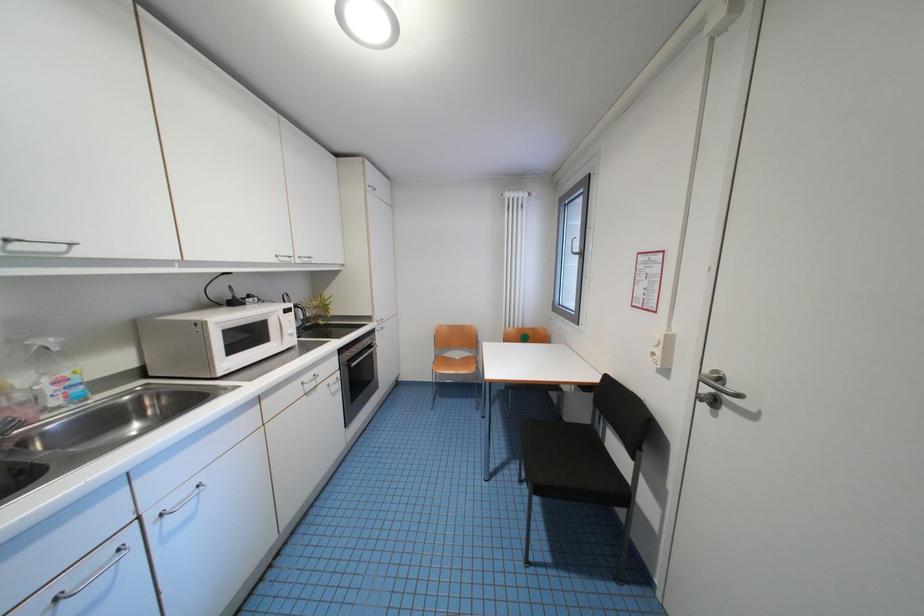
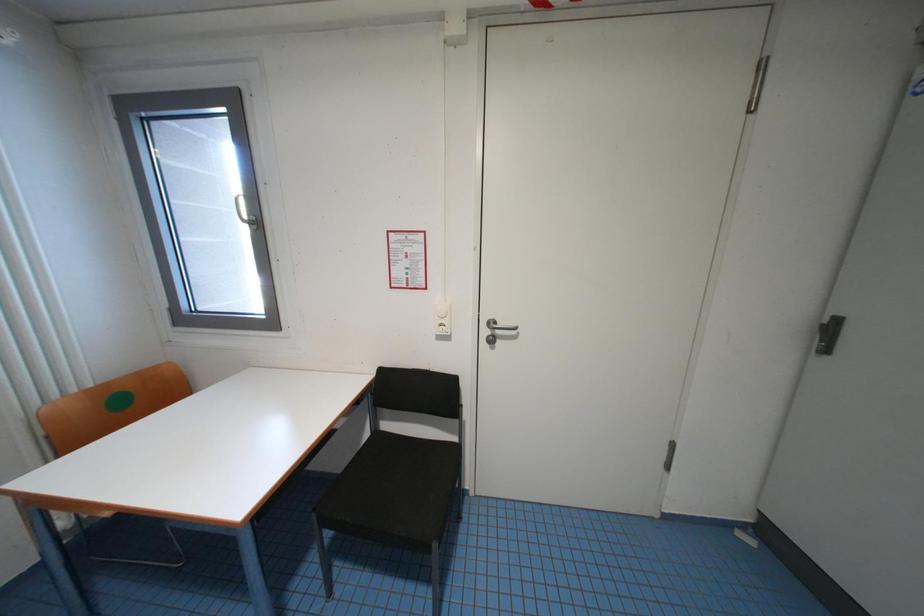
Question: How did the camera likely rotate?

Choices:
 (A) Left
 (B) Right
 (C) Up
 (D) Down

Answer: (B)